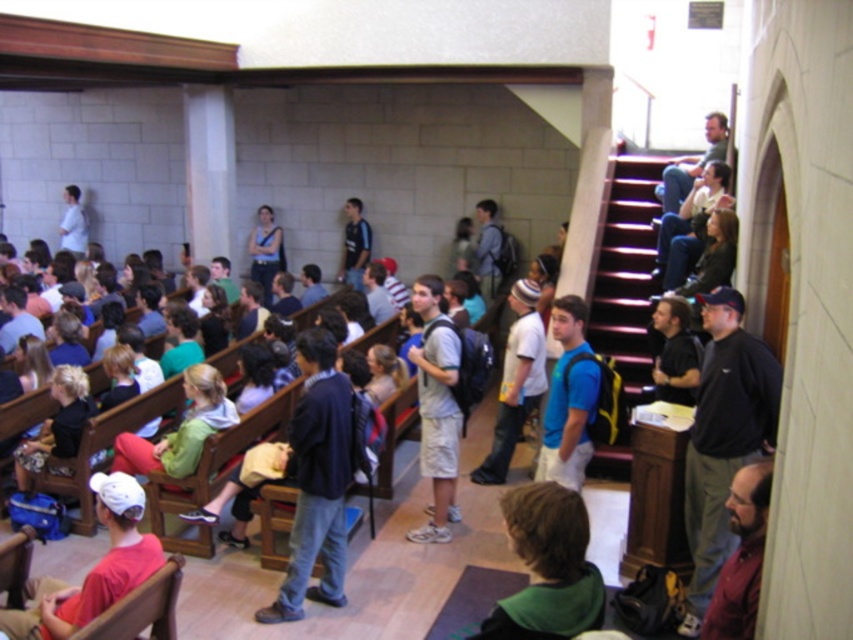
You are organizing a cleanup crew and need to place all items in a small storage bin. The bin can only hold items that are smaller than the blue fabric backpack at center. Will the matte red cap at lower left fit in the bin?

The matte red cap at lower left is bigger than the blue fabric backpack at center, so it will not fit in the bin since the bin can only hold items smaller than the blue fabric backpack at center.

You are sitting at the back of the lecture hall and notice two items in the front row. Which item is closer to you between the matte red cap at lower left and the blue fabric backpack at center?

The matte red cap at lower left is closer to the viewer than the blue fabric backpack at center, so the matte red cap at lower left is closer to you.

You are standing in the lecture hall and want to find the point at coordinate (547, 566). According to the scene description, where would this point be located?

The point at coordinate (547, 566) is on the green fabric shirt at lower center.